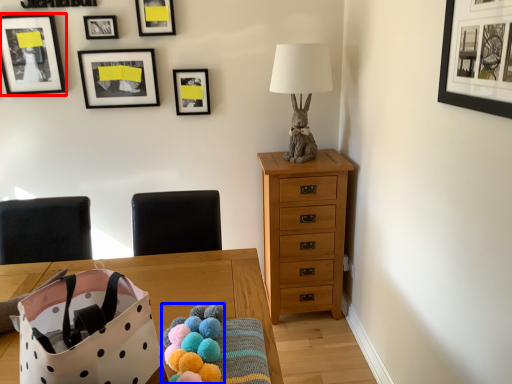
Question: Among these objects, which one is nearest to the camera, picture frame (highlighted by a red box) or stuff (highlighted by a blue box)?

Choices:
 (A) picture frame
 (B) stuff

Answer: (B)